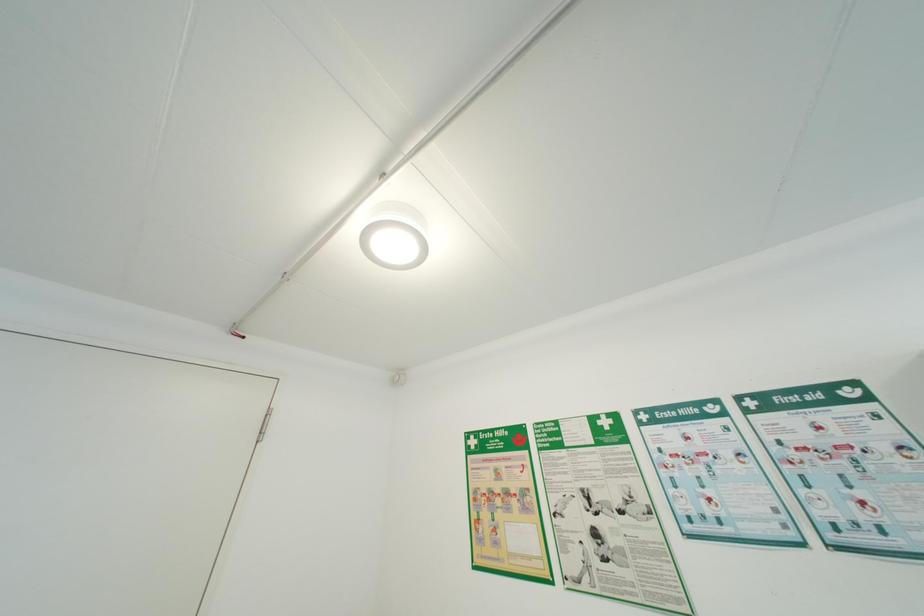
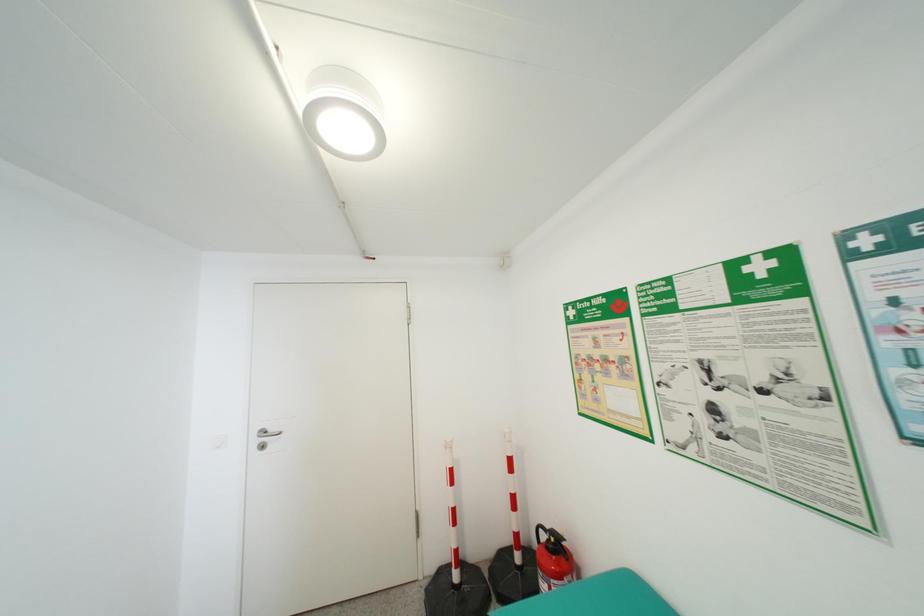
The first image is from the beginning of the video and the second image is from the end. How did the camera likely rotate when shooting the video?

The rotation direction of the camera is left-down.